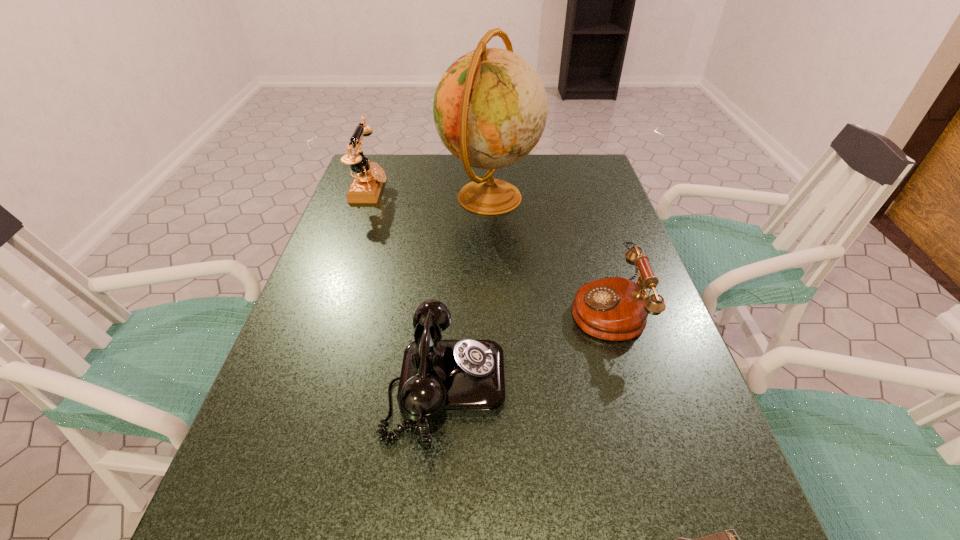
This screenshot has height=540, width=960. Find the location of `telephone that is the third closest to the tallest object`. telephone that is the third closest to the tallest object is located at coordinates (438, 377).

You are a GUI agent. You are given a task and a screenshot of the screen. Output one action in this format:
    pyautogui.click(x=<x>, y=<y>)
    Task: Click on the telephone that is the closest to the watch
    This screenshot has height=540, width=960.
    Given the screenshot: What is the action you would take?
    pyautogui.click(x=438, y=377)

Find the location of a particular element. vacant region that satisfies the following two spatial constraints: 1. on the dial of the globe; 2. on the left side of the second tallest object is located at coordinates (367, 198).

This screenshot has height=540, width=960. Identify the location of vacant area that satisfies the following two spatial constraints: 1. on the front side of the tallest object; 2. on the dial of the second telephone from right to left. [494, 384].